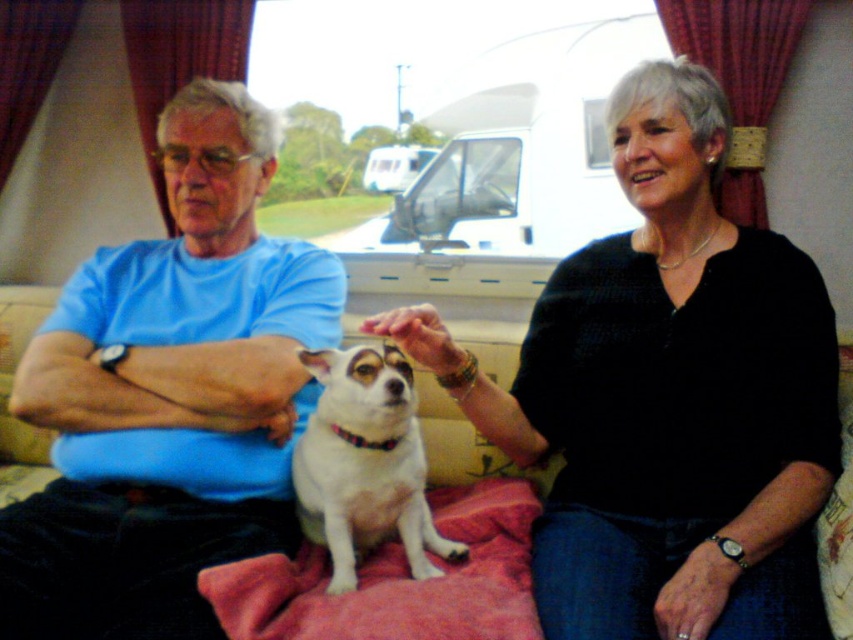
Question: In this image, where is blue t-shirt at left located relative to white fur dog at center?

Choices:
 (A) above
 (B) below

Answer: (A)

Question: Is black knitted sweater at upper right bigger than blue t-shirt at left?

Choices:
 (A) no
 (B) yes

Answer: (A)

Question: Which point appears closest to the camera in this image?

Choices:
 (A) (379, 164)
 (B) (332, 499)
 (C) (189, 113)
 (D) (596, 528)

Answer: (D)

Question: Based on their relative distances, which object is farther from the white fur dog at center?

Choices:
 (A) black knitted sweater at upper right
 (B) blue t-shirt at left

Answer: (A)

Question: Is blue t-shirt at left positioned behind white fur dog at center?

Choices:
 (A) yes
 (B) no

Answer: (B)

Question: Among these points, which one is farthest from the camera?

Choices:
 (A) (247, 124)
 (B) (368, 160)
 (C) (670, 278)
 (D) (350, 541)

Answer: (B)